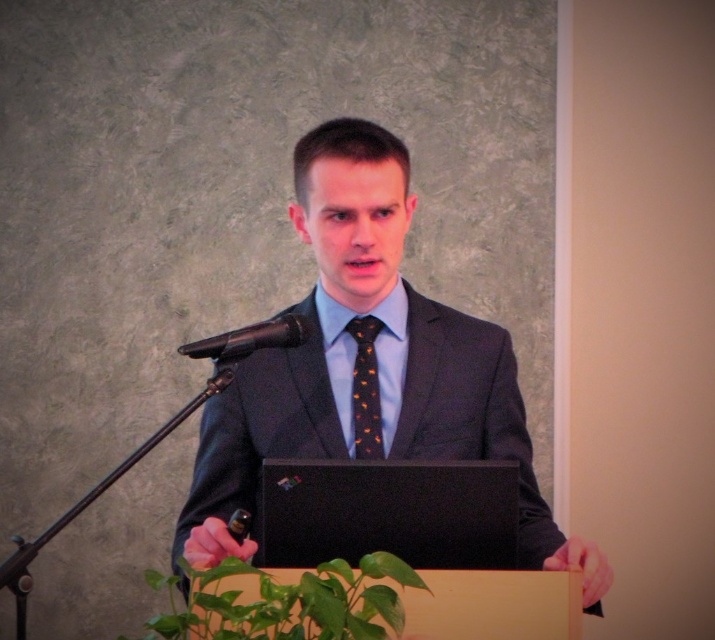
Question: Which point is closer to the camera taking this photo?

Choices:
 (A) (225, 337)
 (B) (369, 456)
 (C) (222, 445)

Answer: (A)

Question: Is matte black suit at center to the right of black metallic microphone at center from the viewer's perspective?

Choices:
 (A) yes
 (B) no

Answer: (A)

Question: Among these objects, which one is nearest to the camera?

Choices:
 (A) matte black suit at center
 (B) black metallic microphone at center
 (C) black dotted tie at center

Answer: (A)

Question: Is black dotted tie at center to the left of black metallic microphone at center from the viewer's perspective?

Choices:
 (A) no
 (B) yes

Answer: (A)

Question: Which point appears closest to the camera in this image?

Choices:
 (A) (373, 420)
 (B) (448, 376)
 (C) (277, 321)

Answer: (C)

Question: Does matte black suit at center lie in front of black metallic microphone at center?

Choices:
 (A) no
 (B) yes

Answer: (B)